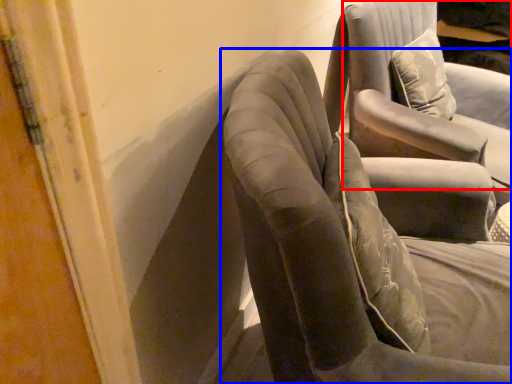
Question: Which object appears closest to the camera in this image, chair (highlighted by a red box) or chair (highlighted by a blue box)?

Choices:
 (A) chair
 (B) chair

Answer: (B)